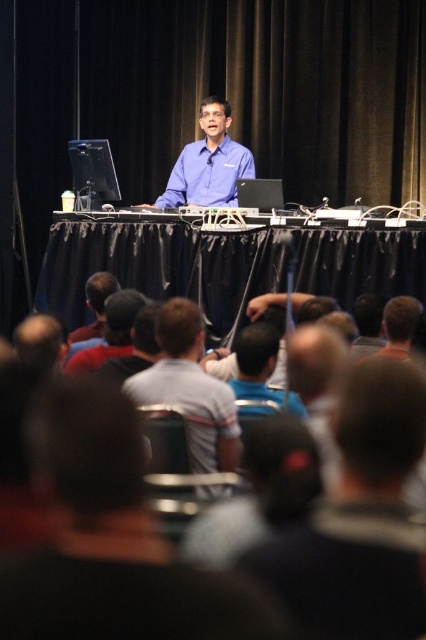
Does white striped shirt at center appear on the left side of black cap at lower left?

No, white striped shirt at center is not to the left of black cap at lower left.

Is point (187, 406) closer to viewer compared to point (118, 330)?

That is True.

Image resolution: width=426 pixels, height=640 pixels. What are the coordinates of `white striped shirt at center` in the screenshot? It's located at (189, 388).

Who is higher up, blue smooth shirt at center or dark blue shirt at center?

blue smooth shirt at center

Between blue smooth shirt at center and dark blue shirt at center, which one appears on the left side from the viewer's perspective?

dark blue shirt at center

Locate an element on the screen. This screenshot has width=426, height=640. blue smooth shirt at center is located at coordinates (207, 163).

Is white striped shirt at center smaller than blue smooth shirt at center?

Indeed, white striped shirt at center has a smaller size compared to blue smooth shirt at center.

Measure the distance between white striped shirt at center and blue smooth shirt at center.

white striped shirt at center is 13.89 feet from blue smooth shirt at center.

What do you see at coordinates (189, 388) in the screenshot? I see `white striped shirt at center` at bounding box center [189, 388].

Identify the location of white striped shirt at center. Image resolution: width=426 pixels, height=640 pixels. (189, 388).